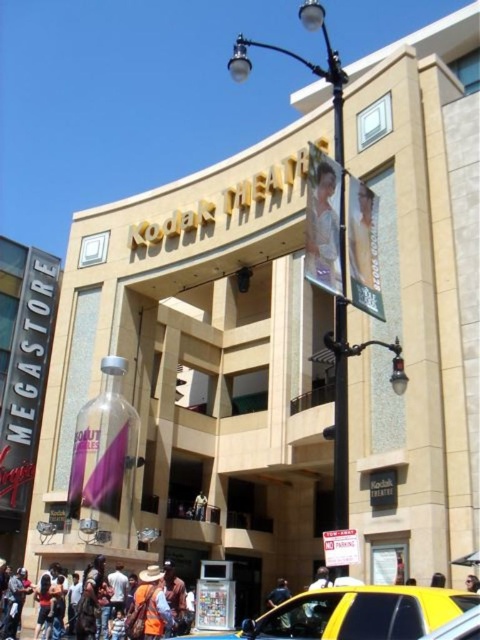
You are standing at the entrance of the Kodak Theatre and want to reach the point at coordinates point [166,564] and point [137,598]. Which point is closer to you?

Point [137,598] is closer to you because it is in front of point [166,564].

You are standing at the Kodak Theatre entrance and want to locate the yellow rubber taxi at lower center. What are the coordinates to find it?

The yellow rubber taxi at lower center is located at coordinates point [355,614].